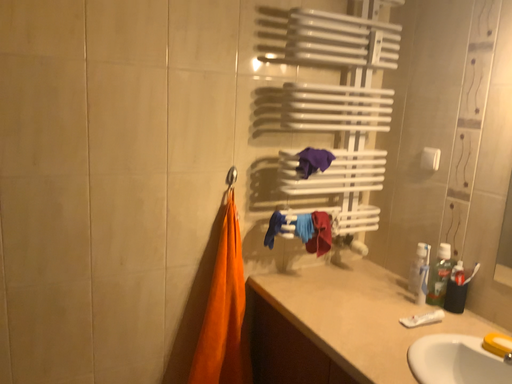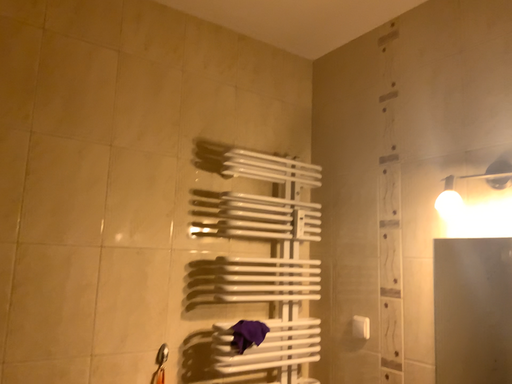
Question: How did the camera likely rotate when shooting the video?

Choices:
 (A) rotated downward
 (B) rotated upward

Answer: (B)